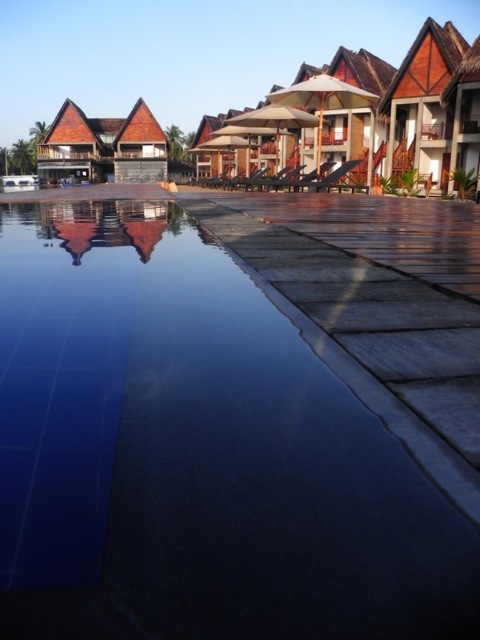
You are a guest at the resort and want to take a photo of the wooden thatched hut at upper right without the transparent glass water at center appearing in the foreground. Is this possible given their positions?

The transparent glass water at center is in front of the wooden thatched hut at upper right, so taking a photo without the water in the foreground would require adjusting your position or angle to avoid the water blocking the view of the hut.

You are standing at the edge of the large swimming pool and see the point marked at coordinates point [195,452]. What is located at that point?

The point [195,452] marks transparent glass water at center.

You are holding a 12 inch long pool skimmer. You want to reach the transparent glass water at center to clean debris. Can you reach it without moving closer? Please explain.

The transparent glass water at center is 20.65 inches away from the viewer. Since the pool skimmer is only 12 inches long, you cannot reach it without moving closer.